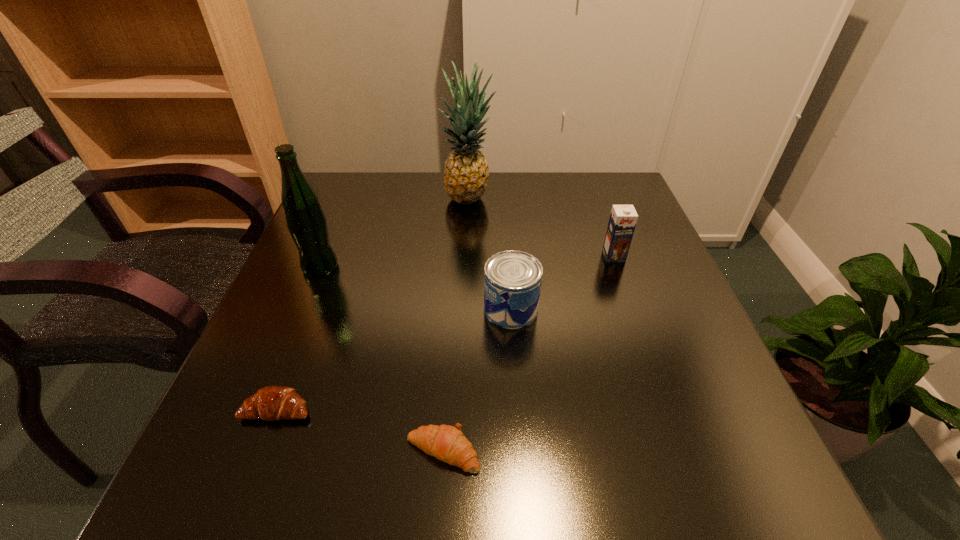
This screenshot has height=540, width=960. Identify the location of the nearer crescent roll. (447, 443).

Locate an element on the screen. The width and height of the screenshot is (960, 540). vacant space located 0.090m on the back of the pineapple is located at coordinates (469, 172).

Where is `free region located 0.320m on the back of the fifth shortest object`? This screenshot has width=960, height=540. free region located 0.320m on the back of the fifth shortest object is located at coordinates (354, 185).

The height and width of the screenshot is (540, 960). I want to click on vacant area situated 0.140m on the front label of the rightmost object, so coord(632,306).

I want to click on free space located 0.360m on the front label of the third nearest object, so click(x=307, y=308).

The height and width of the screenshot is (540, 960). Identify the location of vacant space located on the front label of the third nearest object. (371, 308).

Where is `vacant space located 0.340m on the front label of the third nearest object`? This screenshot has height=540, width=960. vacant space located 0.340m on the front label of the third nearest object is located at coordinates (317, 308).

Identify the location of vacant space situated on the right of the farther crescent roll. Image resolution: width=960 pixels, height=540 pixels. (367, 409).

Image resolution: width=960 pixels, height=540 pixels. I want to click on vacant region located on the right of the nearer crescent roll, so pos(545,451).

You are a GUI agent. You are given a task and a screenshot of the screen. Output one action in this format:
    pyautogui.click(x=<x>, y=<y>)
    Task: Click on the object at the far edge
    Image resolution: width=960 pixels, height=540 pixels.
    Given the screenshot: What is the action you would take?
    pyautogui.click(x=466, y=172)